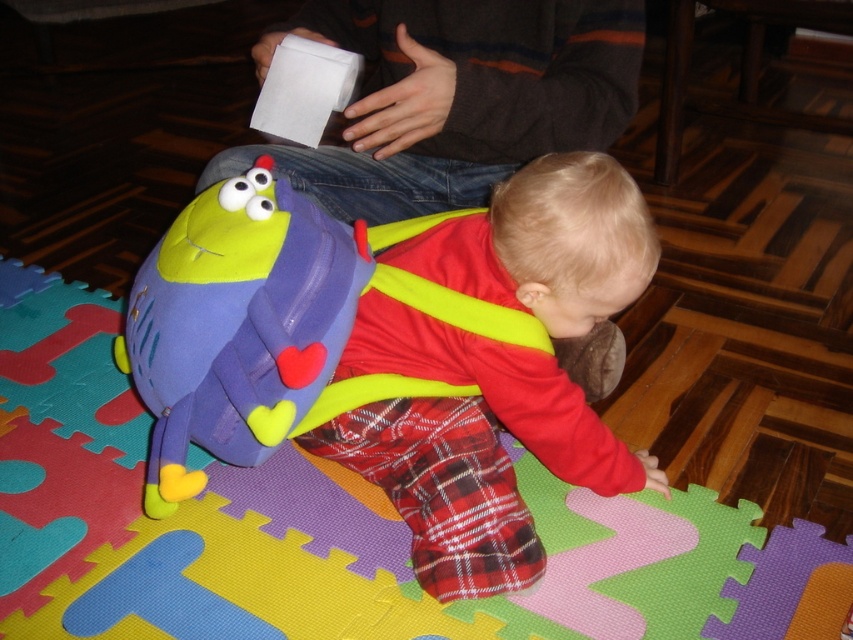
Question: From the image, what is the correct spatial relationship of red plaid pants at center in relation to matte purple backpack at lower left?

Choices:
 (A) below
 (B) above

Answer: (A)

Question: Which point is farther to the camera?

Choices:
 (A) matte purple backpack at lower left
 (B) red plaid pants at center

Answer: (A)

Question: Which of the following is the farthest from the observer?

Choices:
 (A) (427, 442)
 (B) (151, 468)

Answer: (A)

Question: Is red plaid pants at center closer to the viewer compared to matte purple backpack at lower left?

Choices:
 (A) yes
 (B) no

Answer: (A)

Question: Is red plaid pants at center to the left of matte purple backpack at lower left from the viewer's perspective?

Choices:
 (A) no
 (B) yes

Answer: (A)

Question: Which point is farther from the camera taking this photo?

Choices:
 (A) (283, 346)
 (B) (368, 300)

Answer: (B)